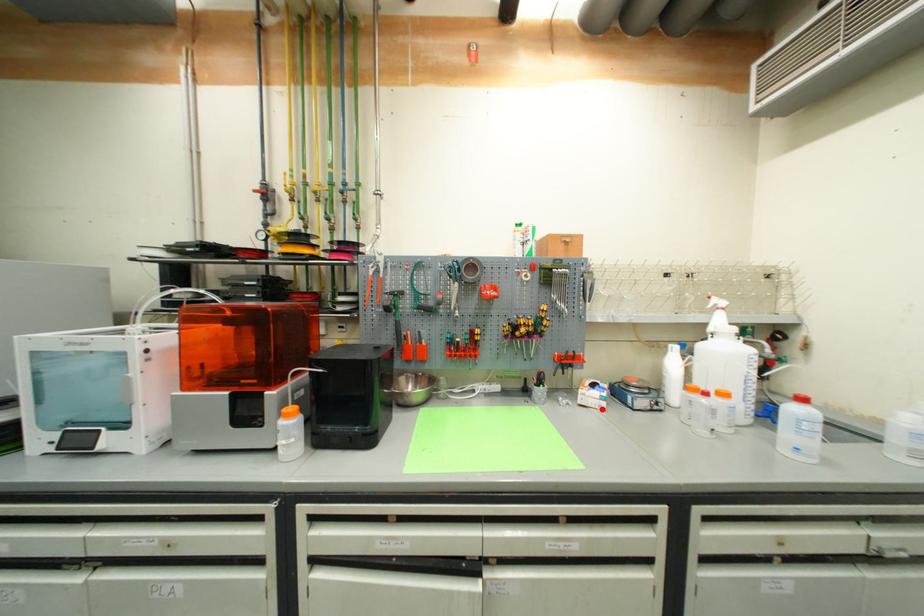
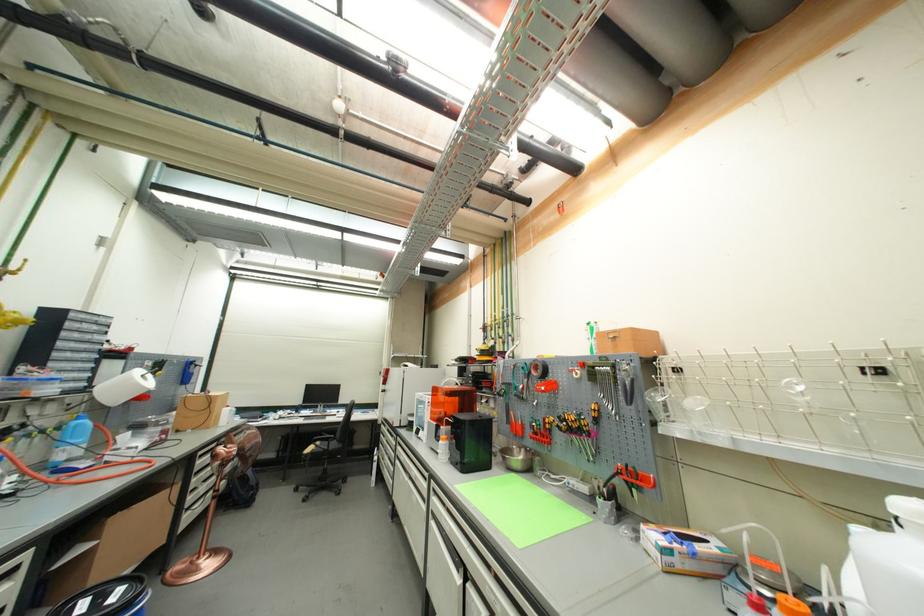
In the second image, find the point that corresponds to the highlighted location in the first image.

(661, 561)